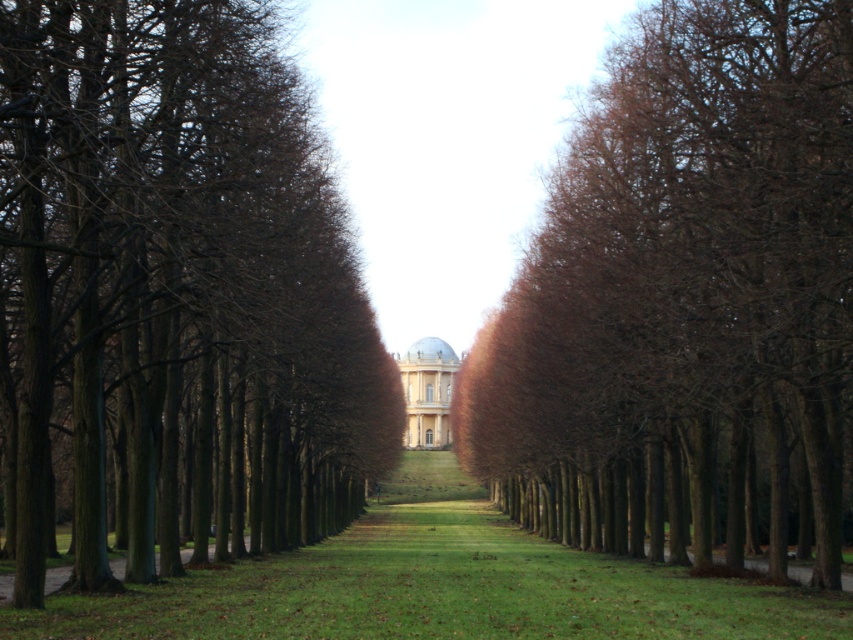
Is point (798, 528) positioned in front of point (402, 470)?

Yes.

Is point (849, 221) farther from camera compared to point (412, 589)?

No, it is not.

The height and width of the screenshot is (640, 853). I want to click on brown smooth tree at center, so click(x=683, y=292).

Describe the element at coordinates (173, 291) in the screenshot. I see `brown textured tree at left` at that location.

Is brown textured tree at left bigger than brown smooth tree at center?

Actually, brown textured tree at left might be smaller than brown smooth tree at center.

This screenshot has width=853, height=640. What do you see at coordinates (173, 291) in the screenshot?
I see `brown textured tree at left` at bounding box center [173, 291].

Find the location of a particular element. The height and width of the screenshot is (640, 853). brown textured tree at left is located at coordinates (173, 291).

Between point (556, 236) and point (422, 440), which one is positioned behind?

Positioned behind is point (422, 440).

Can you confirm if brown smooth tree at center is positioned to the right of matte white dome at center?

Indeed, brown smooth tree at center is positioned on the right side of matte white dome at center.

Is point (607, 172) positioned in front of point (405, 378)?

Yes, point (607, 172) is closer to viewer.

Where is `brown smooth tree at center`? Image resolution: width=853 pixels, height=640 pixels. brown smooth tree at center is located at coordinates (683, 292).